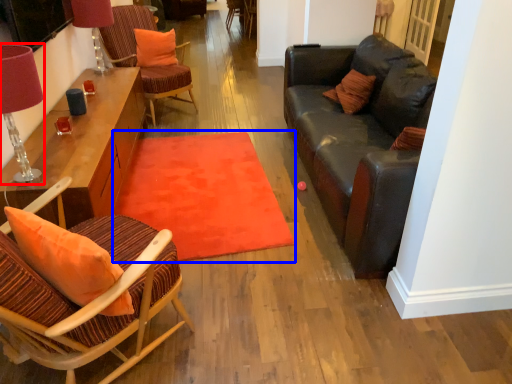
Question: Which object appears farthest to the camera in this image, table lamp (highlighted by a red box) or mat (highlighted by a blue box)?

Choices:
 (A) table lamp
 (B) mat

Answer: (B)